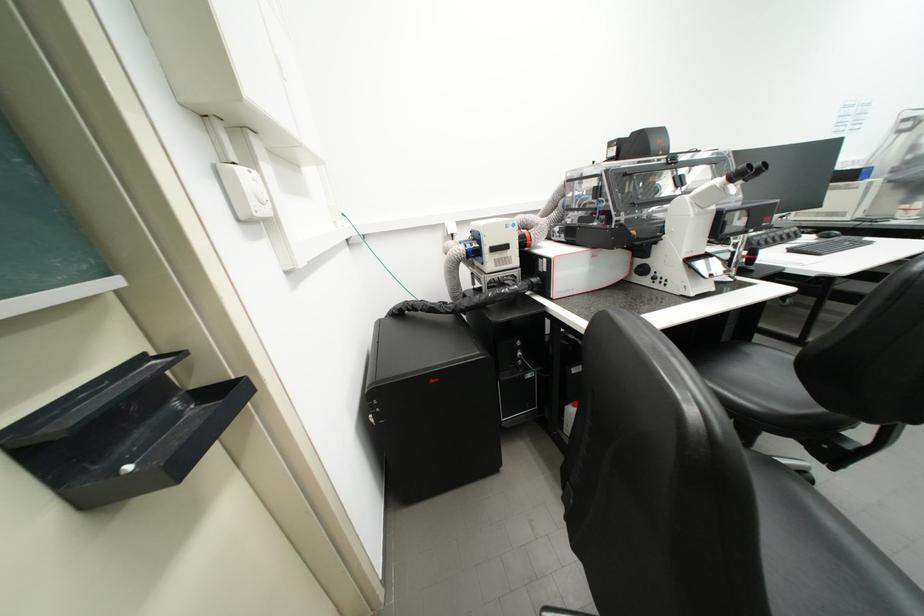
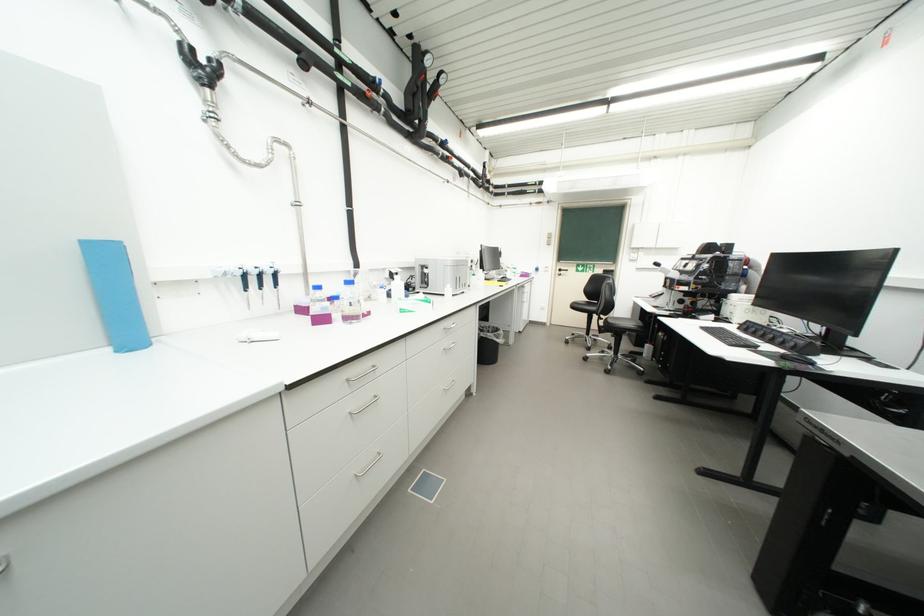
Question: I am providing you with two images of the same scene from different viewpoints. Please identify which objects are invisible in image2.

Choices:
 (A) microscope focusing knob
 (B) chair sitting surface
 (C) computer keyboard
 (D) small red container

Answer: (A)